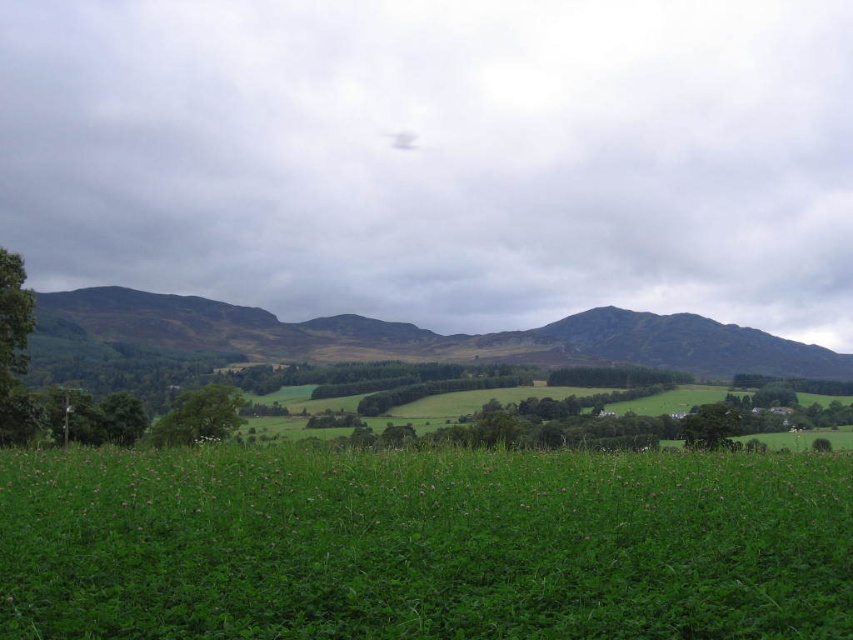
You are standing in the rural landscape and want to take a photo of the green grassy field at center and the rugged brown mountain at center. Which object will appear larger in the photo?

The green grassy field at center will appear larger in the photo because it is closer to you than the rugged brown mountain at center.

Looking at this image, you are a bird soaring above the rural landscape. You notice the white fluffy cloud at upper center and the green grassy field at center. Which one is higher in the sky?

The white fluffy cloud at upper center is higher in the sky than the green grassy field at center because it is taller than the field.

You are standing at the point labeled point (422,545) in the rural landscape. What type of terrain are you currently standing on?

The point (422,545) is on the green grassy field at center, so you are standing on a green grassy field.